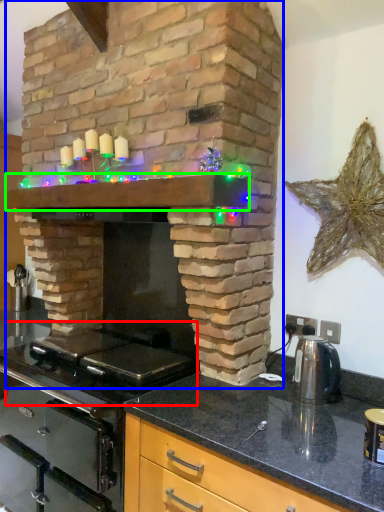
Question: Which object is the farthest from gas stove (highlighted by a red box)? Choose among these: fireplace (highlighted by a blue box) or mantle (highlighted by a green box).

Choices:
 (A) fireplace
 (B) mantle

Answer: (B)